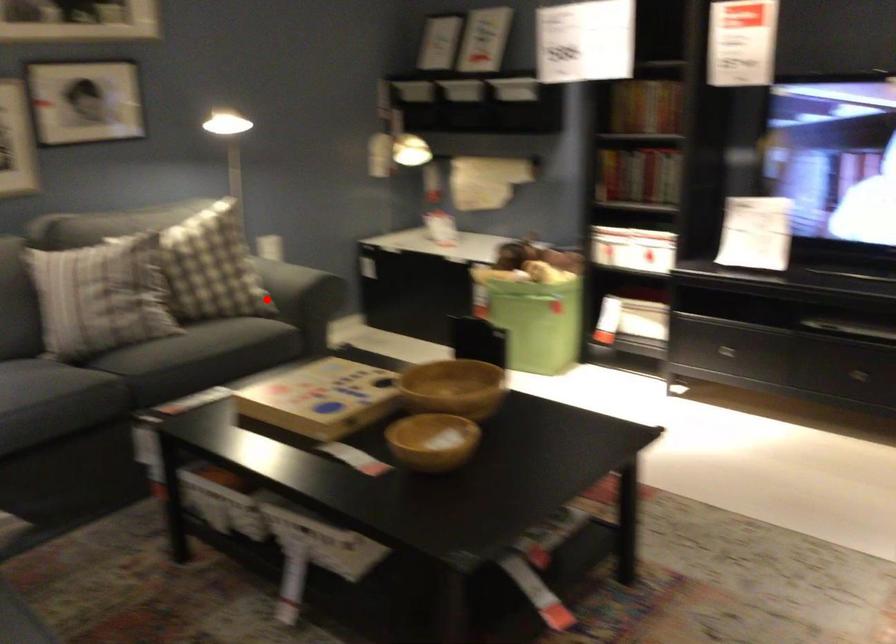
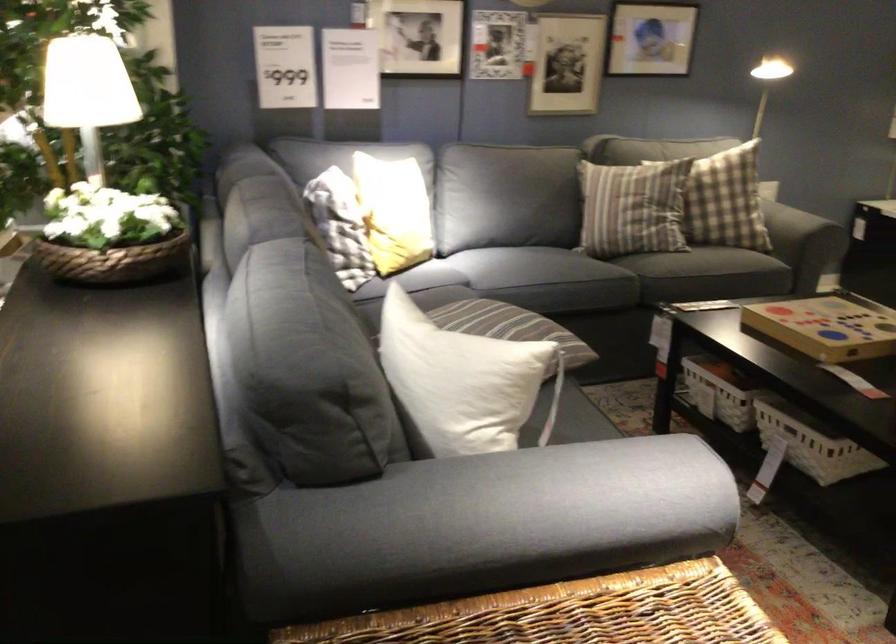
The point at the highlighted location is marked in the first image. Where is the corresponding point in the second image?

(798, 223)